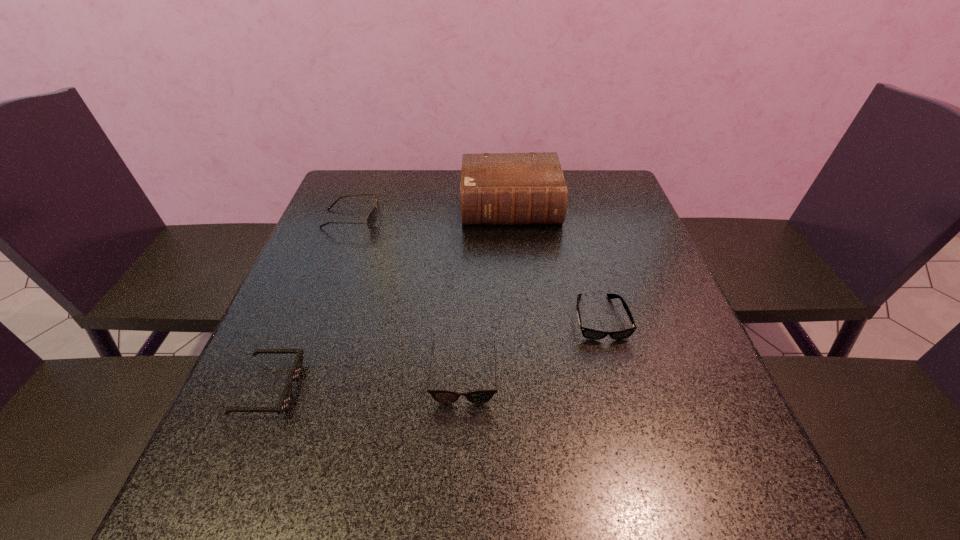
The height and width of the screenshot is (540, 960). I want to click on the tallest object, so click(x=496, y=188).

Find the location of a particular element. Image resolution: width=960 pixels, height=540 pixels. the farthest sunglasses is located at coordinates (372, 217).

Locate an element on the screen. The height and width of the screenshot is (540, 960). the tallest sunglasses is located at coordinates (372, 217).

Identify the location of the second sunglasses from right to left. Image resolution: width=960 pixels, height=540 pixels. (442, 396).

You are a GUI agent. You are given a task and a screenshot of the screen. Output one action in this format:
    pyautogui.click(x=<x>, y=<y>)
    Task: Click on the third nearest object
    This screenshot has height=540, width=960.
    Given the screenshot: What is the action you would take?
    pyautogui.click(x=588, y=333)

Find the location of a particular element. The width and height of the screenshot is (960, 540). the second farthest sunglasses is located at coordinates (588, 333).

Locate an element on the screen. vacant space located on the spine side of the Bible is located at coordinates (515, 256).

At what (x,y) coordinates should I click in order to perform the action: click on free region located 0.190m on the front-facing side of the farthest sunglasses. Please return your answer as a coordinate pair (x, y). Looking at the image, I should click on (447, 219).

The width and height of the screenshot is (960, 540). I want to click on vacant position located 0.140m on the front lenses of the third sunglasses from left to right, so click(460, 483).

Identify the location of vacant region located on the front-facing side of the rightmost sunglasses. This screenshot has height=540, width=960. (654, 515).